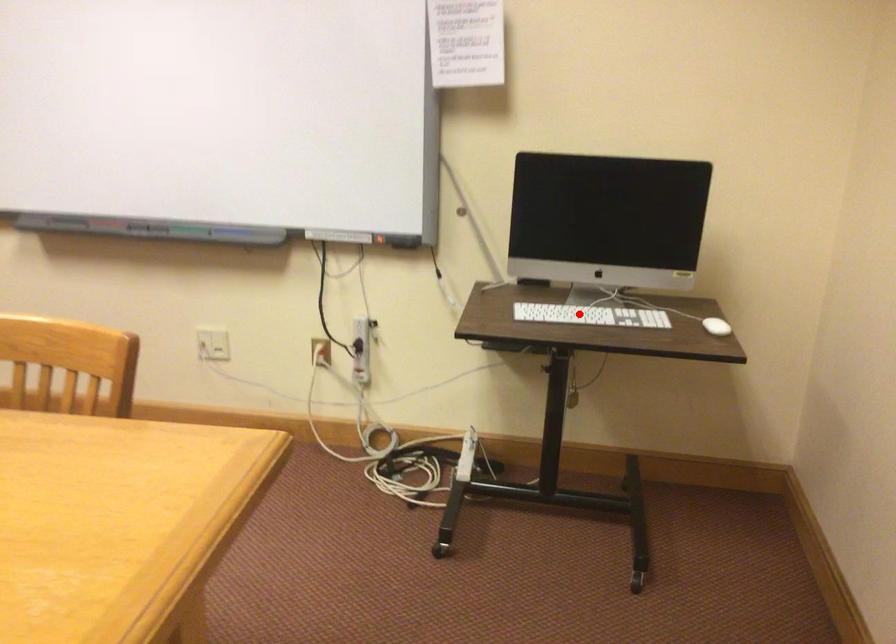
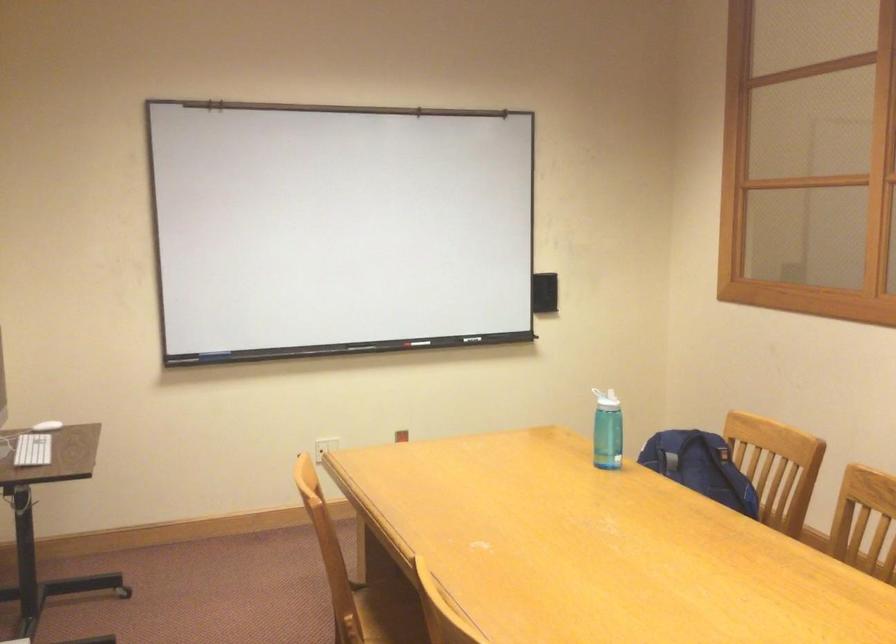
Question: I am providing you with two images of the same scene from different viewpoints. Given a red point in image1, look at the same physical point in image2. Is it:

Choices:
 (A) Closer to the viewpoint
 (B) Farther from the viewpoint

Answer: (B)